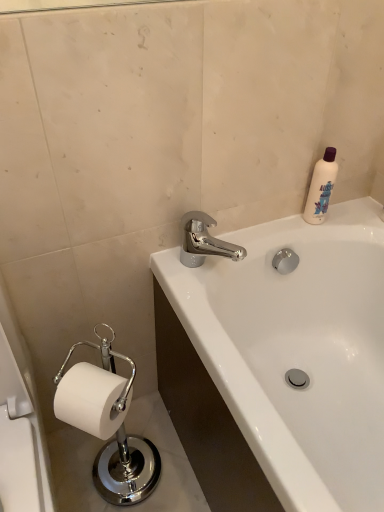
Question: Can you confirm if chrome metallic faucet at upper center is taller than white plastic bottle at upper right?

Choices:
 (A) yes
 (B) no

Answer: (B)

Question: Would you say chrome metallic faucet at upper center contains white plastic bottle at upper right?

Choices:
 (A) yes
 (B) no

Answer: (B)

Question: Does chrome metallic faucet at upper center appear on the left side of white plastic bottle at upper right?

Choices:
 (A) no
 (B) yes

Answer: (B)

Question: Is chrome metallic faucet at upper center aimed at white plastic bottle at upper right?

Choices:
 (A) no
 (B) yes

Answer: (A)

Question: Is chrome metallic faucet at upper center not close to white plastic bottle at upper right?

Choices:
 (A) yes
 (B) no

Answer: (B)

Question: From the image's perspective, would you say chrome metallic faucet at upper center is shown under white plastic bottle at upper right?

Choices:
 (A) yes
 (B) no

Answer: (A)

Question: Is white glossy bathtub at upper right bigger than white paper at lower left?

Choices:
 (A) yes
 (B) no

Answer: (A)

Question: Considering the relative positions of white glossy bathtub at upper right and white paper at lower left in the image provided, is white glossy bathtub at upper right to the left of white paper at lower left from the viewer's perspective?

Choices:
 (A) yes
 (B) no

Answer: (B)

Question: Does white glossy bathtub at upper right have a greater width compared to white paper at lower left?

Choices:
 (A) yes
 (B) no

Answer: (A)

Question: From a real-world perspective, is white glossy bathtub at upper right physically above white paper at lower left?

Choices:
 (A) no
 (B) yes

Answer: (A)

Question: Can you confirm if white glossy bathtub at upper right is positioned to the right of white paper at lower left?

Choices:
 (A) no
 (B) yes

Answer: (B)

Question: From the image's perspective, is white glossy bathtub at upper right above white paper at lower left?

Choices:
 (A) no
 (B) yes

Answer: (B)

Question: Is white plastic bottle at upper right directly adjacent to white paper at lower left?

Choices:
 (A) no
 (B) yes

Answer: (A)